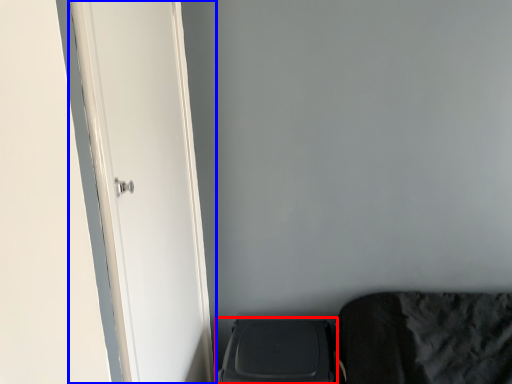
Question: Which object is closer to the camera taking this photo, appliance (highlighted by a red box) or door (highlighted by a blue box)?

Choices:
 (A) appliance
 (B) door

Answer: (B)